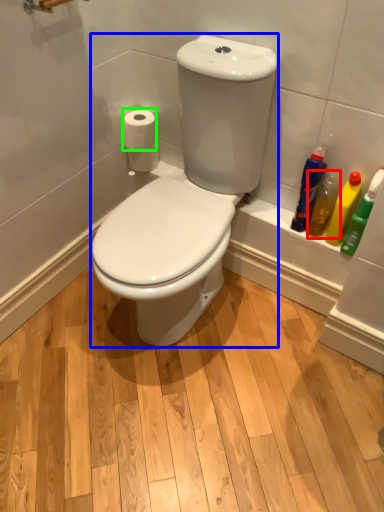
Question: Which object is the farthest from cleaning product (highlighted by a red box)? Choose among these: sit (highlighted by a blue box) or toilet paper (highlighted by a green box).

Choices:
 (A) sit
 (B) toilet paper

Answer: (B)